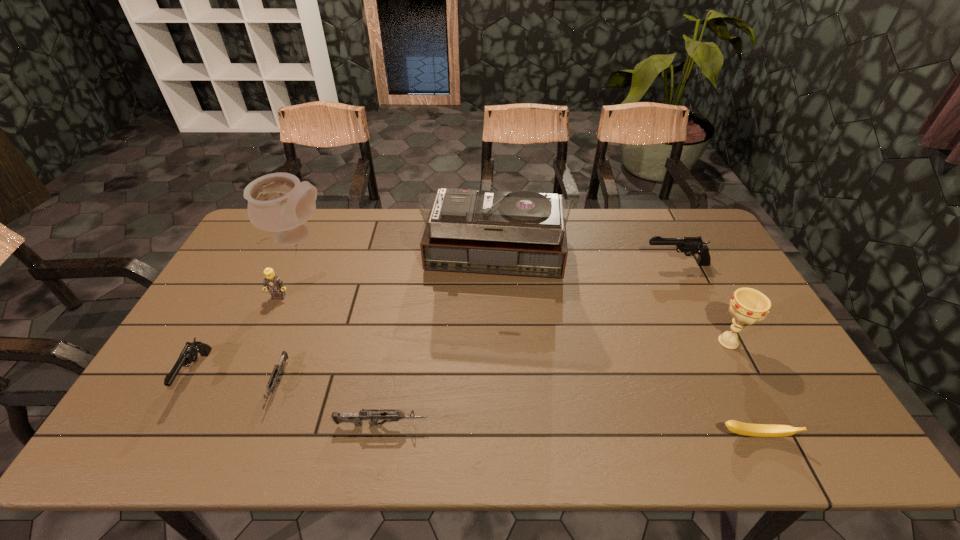
In the image, there is a desktop. At what (x,y) coordinates should I click in order to perform the action: click on vacant space at the near right corner. Please return your answer as a coordinate pair (x, y). The width and height of the screenshot is (960, 540). Looking at the image, I should click on (836, 437).

The height and width of the screenshot is (540, 960). I want to click on vacant region between the record player and the yellow banana, so click(x=625, y=350).

Find the location of a particular element. vacant area between the banana and the Lego is located at coordinates (516, 366).

At what (x,y) coordinates should I click in order to perform the action: click on empty space between the tallest object and the right black gun. Please return your answer as a coordinate pair (x, y). The image size is (960, 540). Looking at the image, I should click on (586, 264).

Locate an element on the screen. free spot between the banana and the pottery is located at coordinates (526, 336).

I want to click on vacant space that is in between the eighth shortest object and the yellow banana, so click(526, 336).

Where is `free space between the farthest gun and the chalice`? The height and width of the screenshot is (540, 960). free space between the farthest gun and the chalice is located at coordinates (702, 303).

Find the location of `blank region between the tallest object and the bigger grey gun`. blank region between the tallest object and the bigger grey gun is located at coordinates (439, 345).

Find the location of a particular element. The width and height of the screenshot is (960, 540). vacant space that's between the pottery and the record player is located at coordinates (396, 251).

At what (x,y) coordinates should I click in order to perform the action: click on empty location between the rightmost gun and the nearest gun. Please return your answer as a coordinate pair (x, y). Image resolution: width=960 pixels, height=540 pixels. Looking at the image, I should click on (529, 345).